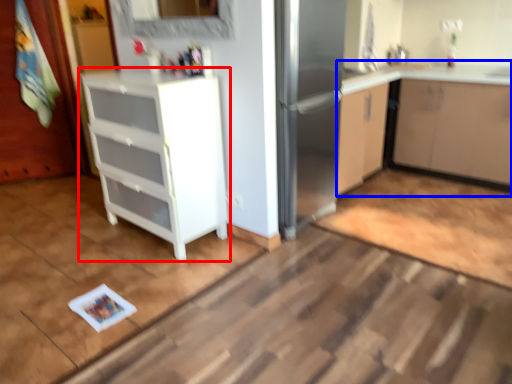
Question: Which of the following is the farthest to the observer, cabinetry (highlighted by a red box) or cabinetry (highlighted by a blue box)?

Choices:
 (A) cabinetry
 (B) cabinetry

Answer: (B)